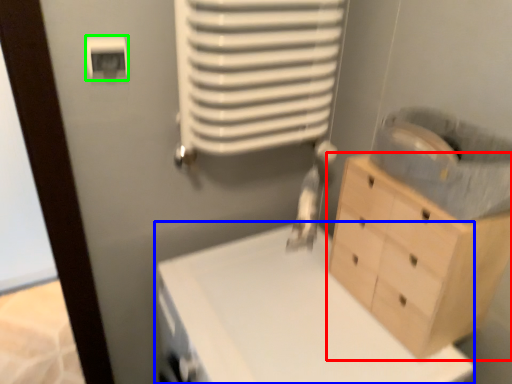
Question: Which object is the closest to the chest of drawers (highlighted by a red box)? Choose among these: changing table (highlighted by a blue box) or light switch (highlighted by a green box).

Choices:
 (A) changing table
 (B) light switch

Answer: (A)